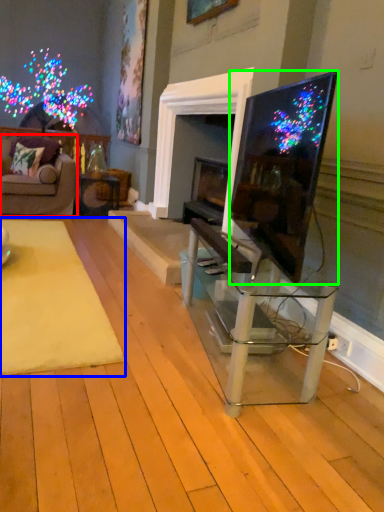
Question: Estimate the real-world distances between objects in this image. Which object is closer to studio couch (highlighted by a red box), mat (highlighted by a blue box) or television (highlighted by a green box)?

Choices:
 (A) mat
 (B) television

Answer: (A)